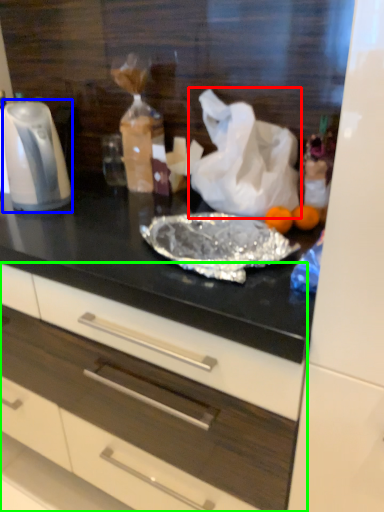
Question: Considering the real-world distances, which object is closest to plastic bag (highlighted by a red box)? kitchen appliance (highlighted by a blue box) or drawer (highlighted by a green box).

Choices:
 (A) kitchen appliance
 (B) drawer

Answer: (A)